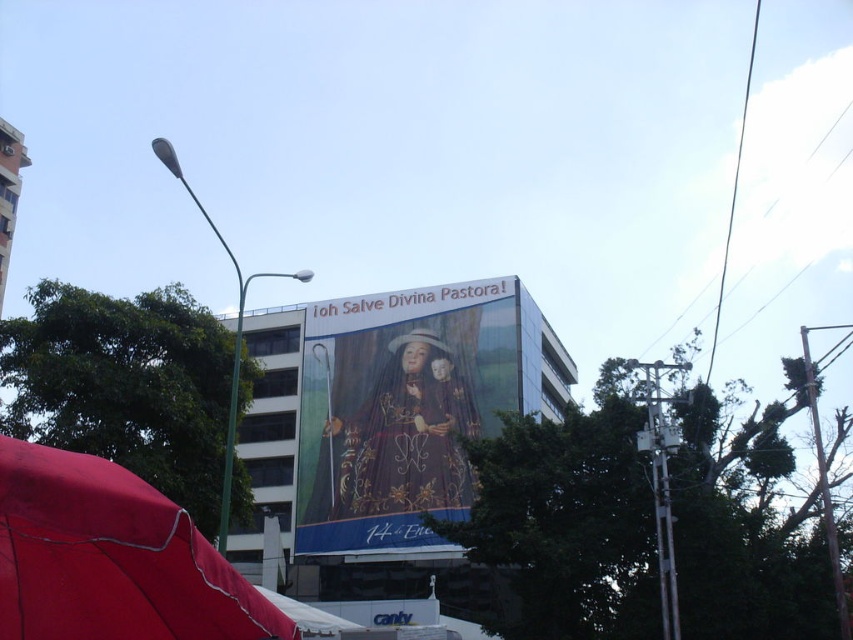
Question: Which of the following is the farthest from the observer?

Choices:
 (A) (428, 440)
 (B) (0, 522)

Answer: (A)

Question: Which of the following is the closest to the observer?

Choices:
 (A) red fabric umbrella at lower left
 (B) matte gold painting at center

Answer: (A)

Question: Is matte gold painting at center positioned behind red fabric umbrella at lower left?

Choices:
 (A) no
 (B) yes

Answer: (B)

Question: Is matte gold painting at center bigger than red fabric umbrella at lower left?

Choices:
 (A) no
 (B) yes

Answer: (B)

Question: Can you confirm if matte gold painting at center is positioned below red fabric umbrella at lower left?

Choices:
 (A) no
 (B) yes

Answer: (B)